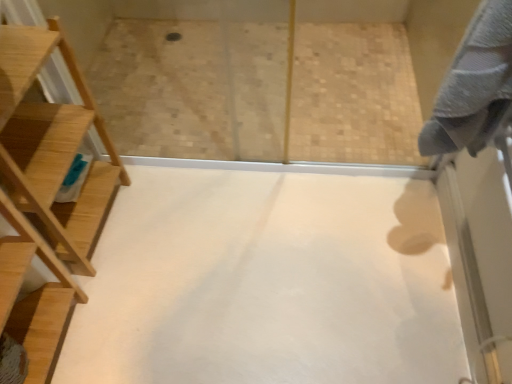
Question: Is natural wood ladder at left at the right side of gray cotton bath towel at upper right?

Choices:
 (A) no
 (B) yes

Answer: (A)

Question: Are natural wood ladder at left and gray cotton bath towel at upper right far apart?

Choices:
 (A) yes
 (B) no

Answer: (B)

Question: Considering the relative sizes of natural wood ladder at left and gray cotton bath towel at upper right in the image provided, is natural wood ladder at left shorter than gray cotton bath towel at upper right?

Choices:
 (A) yes
 (B) no

Answer: (B)

Question: Does natural wood ladder at left appear on the left side of gray cotton bath towel at upper right?

Choices:
 (A) no
 (B) yes

Answer: (B)

Question: Considering the relative sizes of natural wood ladder at left and gray cotton bath towel at upper right in the image provided, is natural wood ladder at left taller than gray cotton bath towel at upper right?

Choices:
 (A) no
 (B) yes

Answer: (B)

Question: From a real-world perspective, is white matte floor at center above or below natural wood ladder at left?

Choices:
 (A) above
 (B) below

Answer: (B)

Question: Does point (305, 218) appear closer or farther from the camera than point (74, 104)?

Choices:
 (A) farther
 (B) closer

Answer: (A)

Question: From their relative heights in the image, would you say white matte floor at center is taller or shorter than natural wood ladder at left?

Choices:
 (A) short
 (B) tall

Answer: (A)

Question: Is white matte floor at center spatially inside natural wood ladder at left, or outside of it?

Choices:
 (A) outside
 (B) inside

Answer: (A)

Question: From the image's perspective, is natural wood ladder at left located above or below gray cotton bath towel at upper right?

Choices:
 (A) below
 (B) above

Answer: (A)

Question: Relative to gray cotton bath towel at upper right, is natural wood ladder at left in front or behind?

Choices:
 (A) behind
 (B) front

Answer: (A)

Question: Is natural wood ladder at left inside or outside of gray cotton bath towel at upper right?

Choices:
 (A) inside
 (B) outside

Answer: (B)

Question: Is natural wood ladder at left bigger or smaller than gray cotton bath towel at upper right?

Choices:
 (A) big
 (B) small

Answer: (A)

Question: Visually, is gray cotton bath towel at upper right positioned to the left or to the right of natural wood ladder at left?

Choices:
 (A) right
 (B) left

Answer: (A)

Question: From a real-world perspective, is gray cotton bath towel at upper right above or below natural wood ladder at left?

Choices:
 (A) above
 (B) below

Answer: (A)